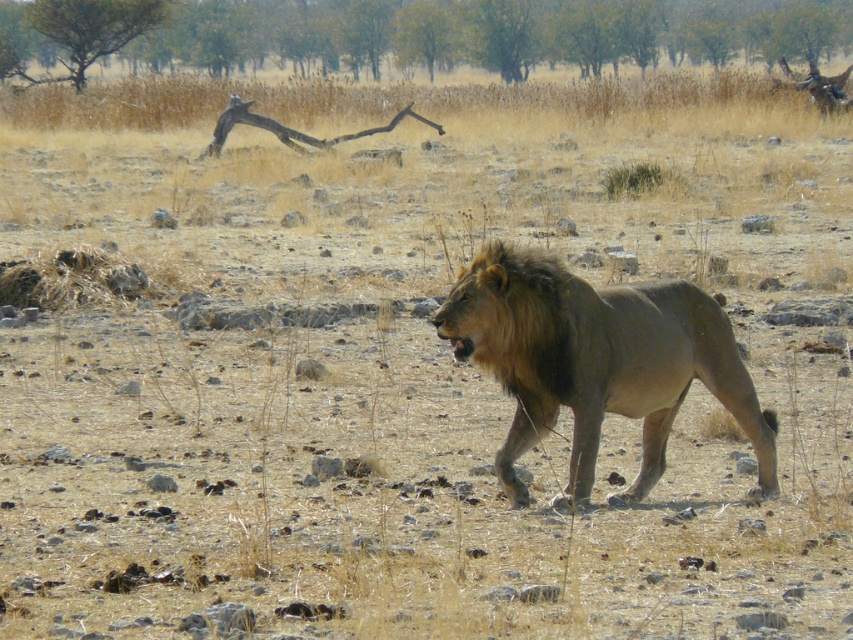
You are a wildlife photographer using a camera with a 100mm lens. You want to take a closeup shot of the golden fur lion at center from your current position. Considering the distance between you and the lion, will the 100mm lens allow you to capture a clear closeup without moving closer?

The golden fur lion at center and camera are 6.05 meters apart from each other. A 100mm lens is suitable for capturing closeup shots from distances around 6 meters, so yes, the 100mm lens should allow you to take a clear closeup without moving closer.

In the scene shown: You are a photographer standing in the savanna. You want to capture a photo where the golden fur lion at center is framed by the green leafy tree at upper center. Based on their sizes, do you think this is possible?

The green leafy tree at upper center might be wider than golden fur lion at center, so it is possible to frame the golden fur lion at center within the tree if the tree is indeed wider.

You are a safari guide standing in the savanna and see the point marked at coordinates (428, 33). What does this point correspond to in the scene?

The point at coordinates (428, 33) corresponds to the green leafy tree at upper center.